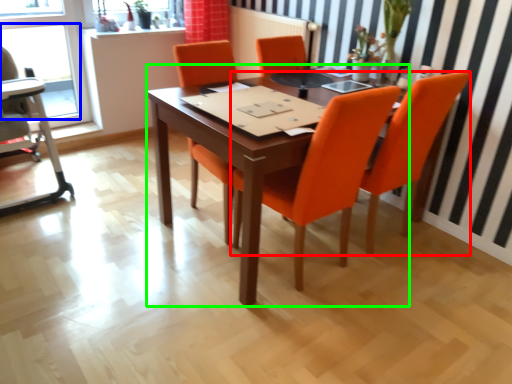
Question: Which object is positioned farthest from chair (highlighted by a red box)? Select from window (highlighted by a blue box) and table (highlighted by a green box).

Choices:
 (A) window
 (B) table

Answer: (A)